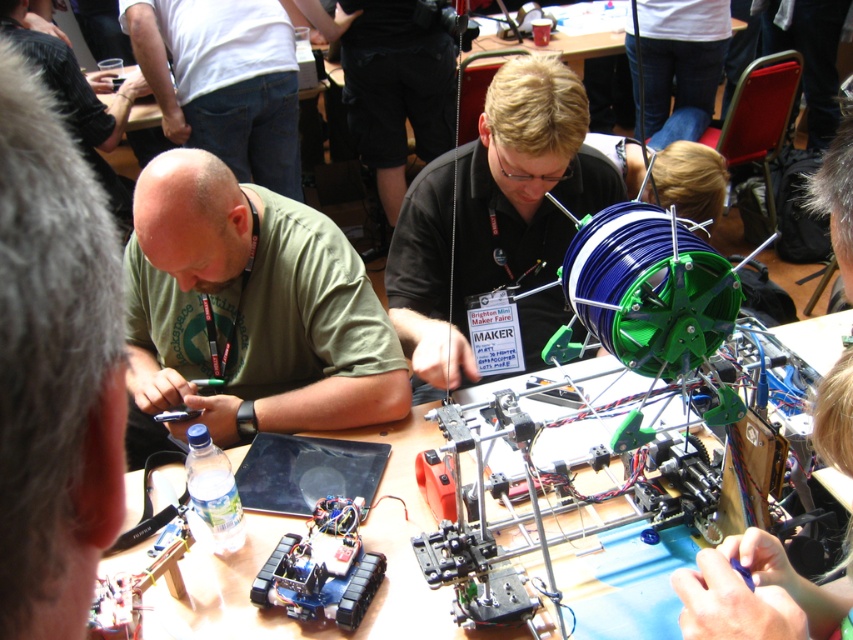
You are a visitor at the maker faire and want to take a photo of the green matte spool at center without blocking the green matte shirt at center. Which object should you move closer to or away from?

The green matte shirt at center is closer to the viewer than the green matte spool at center. To take a photo of the green matte spool at center without blocking it with the green matte shirt at center, you should move the green matte shirt at center away from the camera or move the green matte spool at center closer to the camera.

You are a photographer at the Brighton Mini Maker Faire event and want to capture a photo of the green matte shirt at center and the wooden table at center. Which object should you focus on first if you want to ensure both are in focus without adjusting the camera settings?

The green matte shirt at center is much taller than the wooden table at center, so focusing on the shirt first would ensure both are in focus since it is closer to the camera.